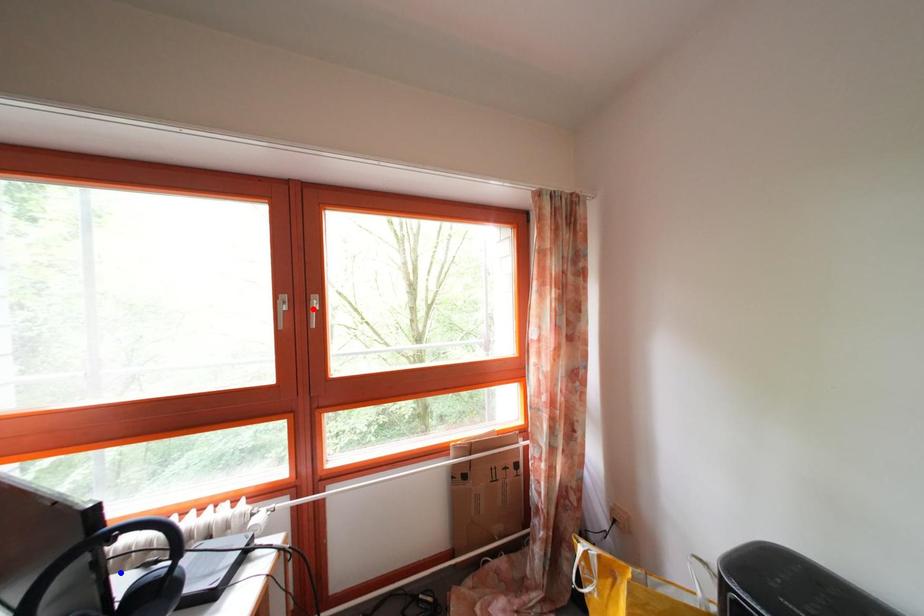
Question: Which of the two points in the image is closer to the camera?

Choices:
 (A) Blue point is closer.
 (B) Red point is closer.

Answer: (A)